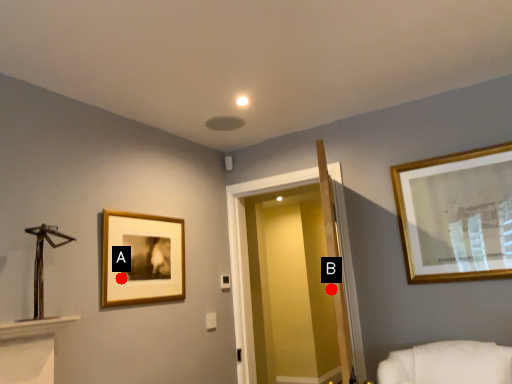
Question: Two points are circled on the image, labeled by A and B beside each circle. Which point appears farthest from the camera in this image?

Choices:
 (A) A is further
 (B) B is further

Answer: (B)